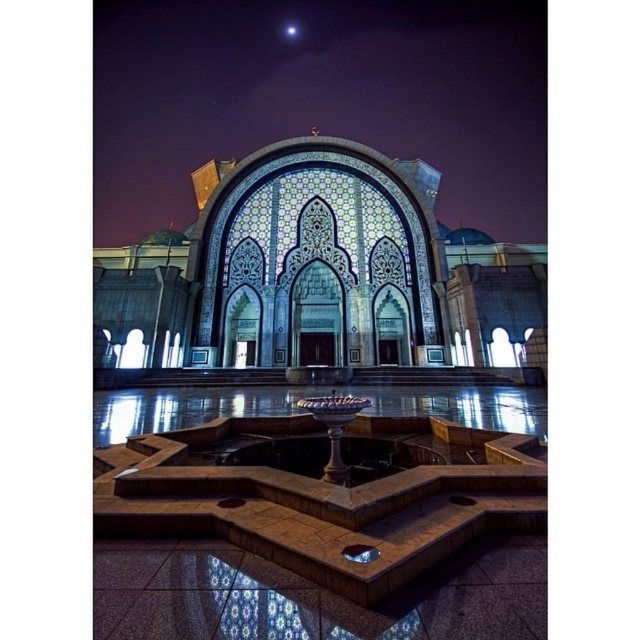
Question: In this image, where is polished stone fountain at center located relative to white marble fountain at center?

Choices:
 (A) right
 (B) left

Answer: (B)

Question: Estimate the real-world distances between objects in this image. Which object is closer to the white marble fountain at center?

Choices:
 (A) polished stone palace at center
 (B) polished stone fountain at center

Answer: (A)

Question: Which object is the closest to the polished stone fountain at center?

Choices:
 (A) polished stone palace at center
 (B) white marble fountain at center

Answer: (A)

Question: Which point is closer to the camera?

Choices:
 (A) polished stone fountain at center
 (B) polished stone palace at center
 (C) white marble fountain at center

Answer: (A)

Question: Is polished stone palace at center wider than white marble fountain at center?

Choices:
 (A) no
 (B) yes

Answer: (B)

Question: Is polished stone fountain at center smaller than polished stone palace at center?

Choices:
 (A) no
 (B) yes

Answer: (A)